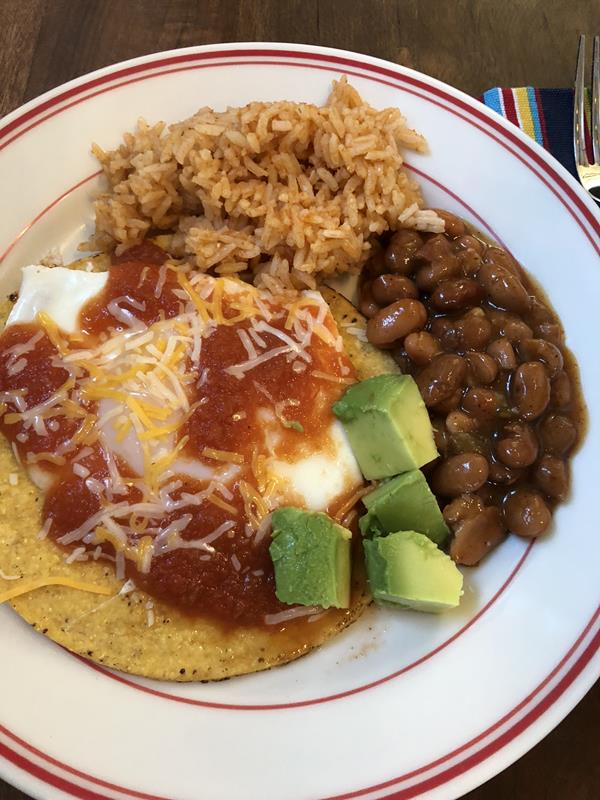
Image resolution: width=600 pixels, height=800 pixels. I want to click on napkin, so click(x=537, y=106).